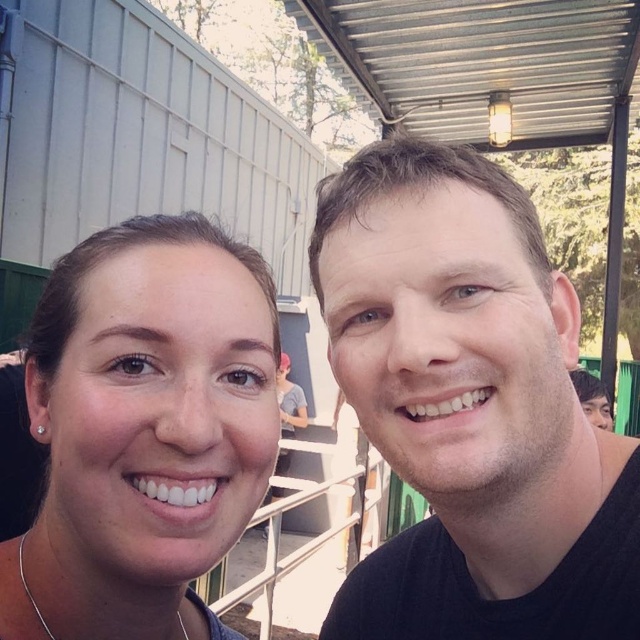
You are a photographer setting up for a group photo. You notice the matte skin at center and the silver chain at lower left in your frame. Which object should you adjust to ensure both are fully visible in the photo?

The silver chain at lower left is shorter than the matte skin at center. To ensure both are fully visible, adjust the camera angle or position so that the silver chain at lower left is not cut off at the bottom of the frame.

You are a photographer trying to frame a shot of the black matte shirt at right and the silver chain at lower left. Which object should you focus on first if you want to capture both in a single frame without moving the camera?

The silver chain at lower left should be focused on first because it is smaller in size compared to the black matte shirt at right, allowing the photographer to adjust the framing to include both objects without moving the camera.